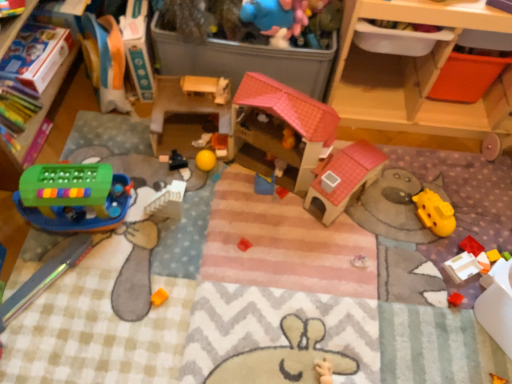
The width and height of the screenshot is (512, 384). What are the coordinates of `vacant space behind yellow plastic spoon at center, marked as the 3th toy in a right-to-left arrangement` in the screenshot? It's located at (259, 166).